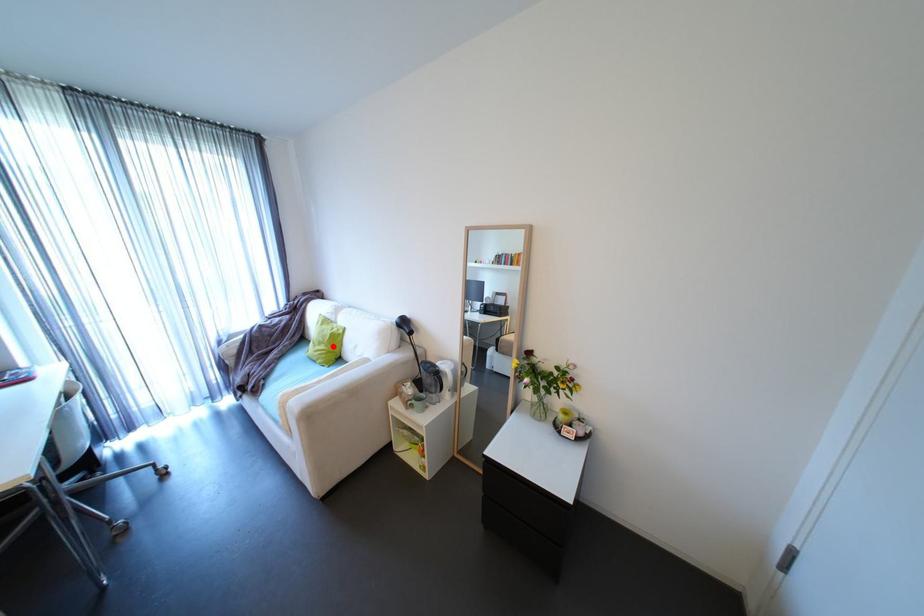
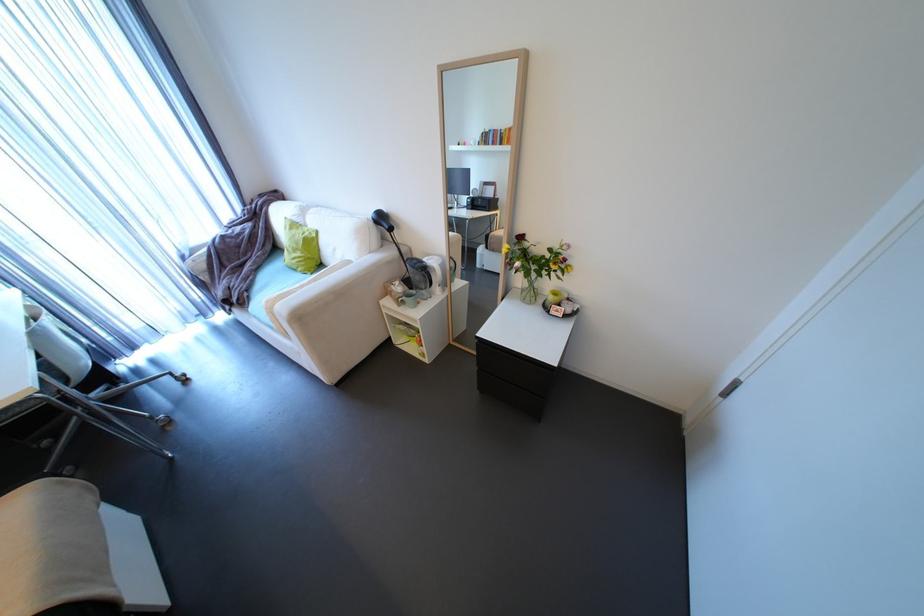
The point at the highlighted location is marked in the first image. Where is the corresponding point in the second image?

(310, 253)